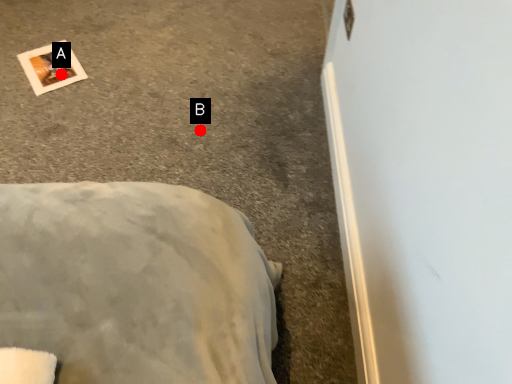
Question: Two points are circled on the image, labeled by A and B beside each circle. Which point is farther to the camera?

Choices:
 (A) A is further
 (B) B is further

Answer: (A)